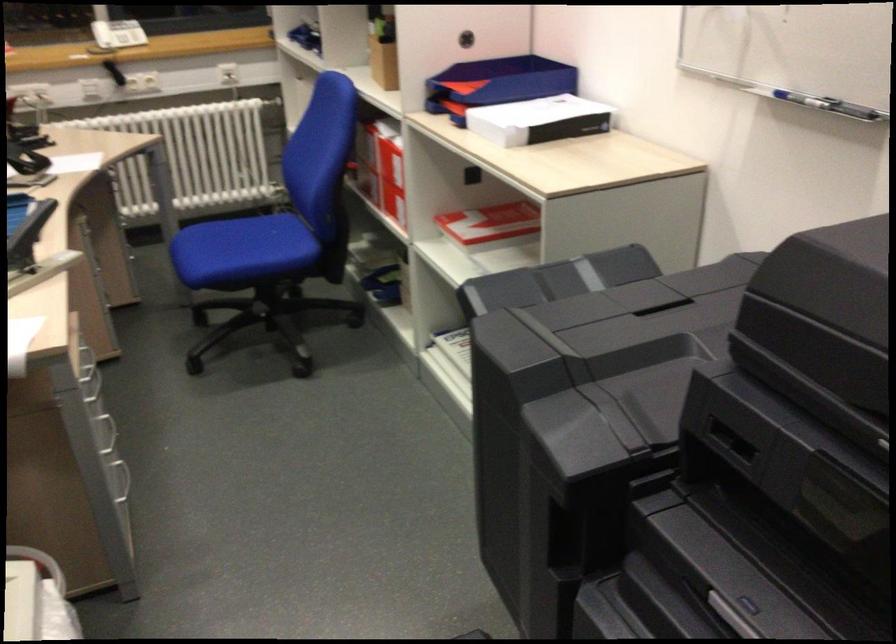
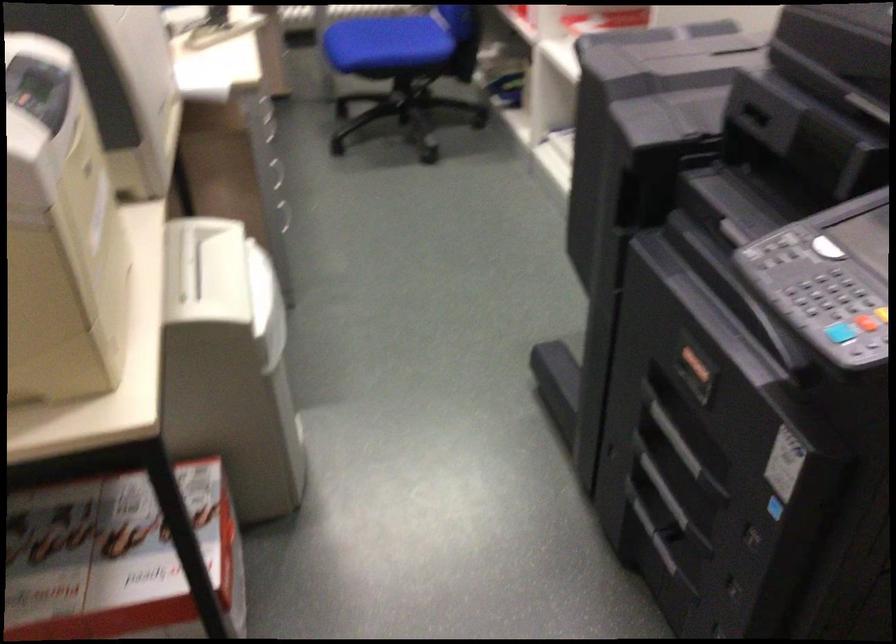
Question: Which direction would the cameraman need to move to produce the second image? Reply with the corresponding letter.

Choices:
 (A) Left
 (B) Right
 (C) Forward
 (D) Backward

Answer: (D)